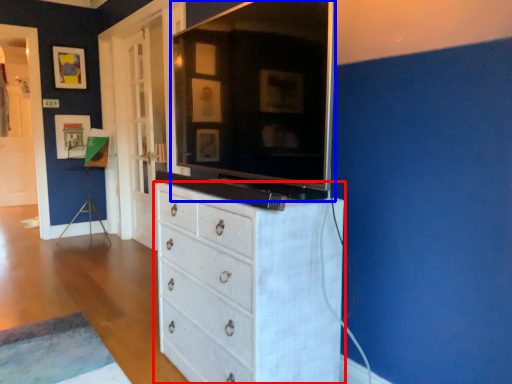
Question: Which object is further to the camera taking this photo, chest of drawers (highlighted by a red box) or tv cabinet (highlighted by a blue box)?

Choices:
 (A) chest of drawers
 (B) tv cabinet

Answer: (A)